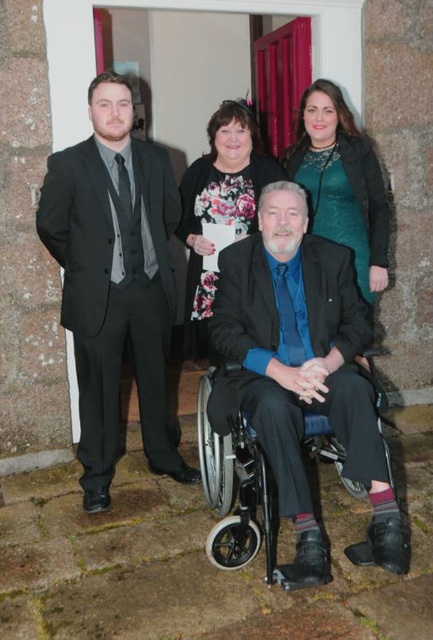
Is matte black wheelchair at center above floral fabric dress at upper center?

Actually, matte black wheelchair at center is below floral fabric dress at upper center.

You are a GUI agent. You are given a task and a screenshot of the screen. Output one action in this format:
    pyautogui.click(x=<x>, y=<y>)
    Task: Click on the matte black wheelchair at center
    Image resolution: width=433 pixels, height=640 pixels.
    Given the screenshot: What is the action you would take?
    pyautogui.click(x=306, y=376)

Locate an element on the screen. The height and width of the screenshot is (640, 433). matte black wheelchair at center is located at coordinates (306, 376).

Can you confirm if matte black wheelchair at center is wider than matte black suit at left?

Correct, the width of matte black wheelchair at center exceeds that of matte black suit at left.

Does matte black wheelchair at center come behind matte black suit at left?

No, it is not.

Identify the location of matte black wheelchair at center. (306, 376).

Is point (87, 278) closer to camera compared to point (229, 483)?

That is False.

Does matte black suit at left appear over silver metallic wheelchair at center?

Correct, matte black suit at left is located above silver metallic wheelchair at center.

The image size is (433, 640). I want to click on matte black suit at left, so click(x=115, y=282).

Where is `matte black suit at left`? matte black suit at left is located at coordinates (115, 282).